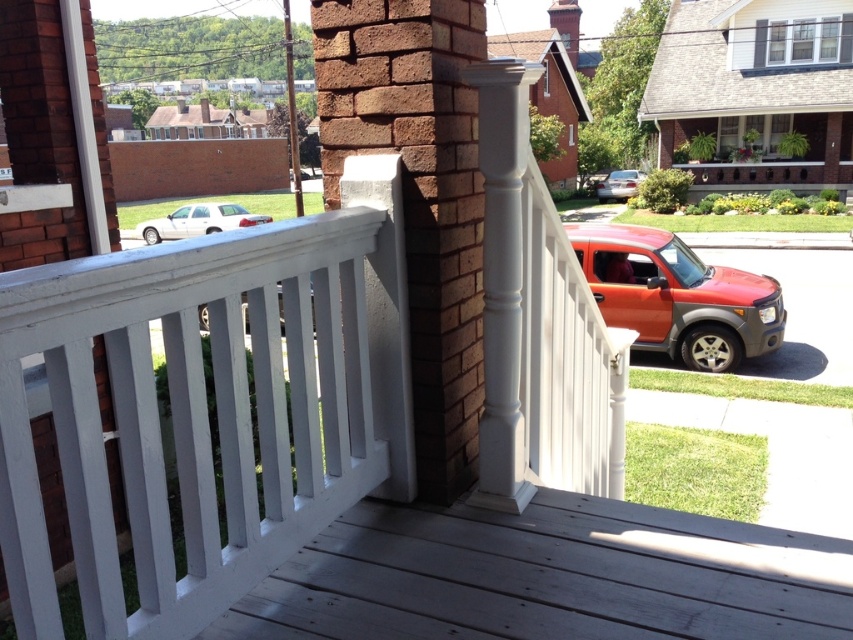
Does white wood deck at center appear on the left side of shiny orange suv at right?

Correct, you'll find white wood deck at center to the left of shiny orange suv at right.

Does point (459, 506) come behind point (775, 284)?

No, it is in front of (775, 284).

Find the location of `white wood deck at center`. white wood deck at center is located at coordinates (550, 577).

Is white wood deck at center positioned behind white matte sedan at center?

No, it is not.

Does white wood deck at center have a larger size compared to white matte sedan at center?

No, white wood deck at center is not bigger than white matte sedan at center.

Between point (706, 532) and point (231, 214), which one is positioned behind?

The point (231, 214) is more distant.

Where is `white wood deck at center`? white wood deck at center is located at coordinates click(x=550, y=577).

Between white matte sedan at center and silver metallic sedan at center-right, which one appears on the right side from the viewer's perspective?

Positioned to the right is silver metallic sedan at center-right.

Is white matte sedan at center wider than silver metallic sedan at center-right?

In fact, white matte sedan at center might be narrower than silver metallic sedan at center-right.

At what (x,y) coordinates should I click in order to perform the action: click on white matte sedan at center. Please return your answer as a coordinate pair (x, y). The image size is (853, 640). Looking at the image, I should click on (198, 221).